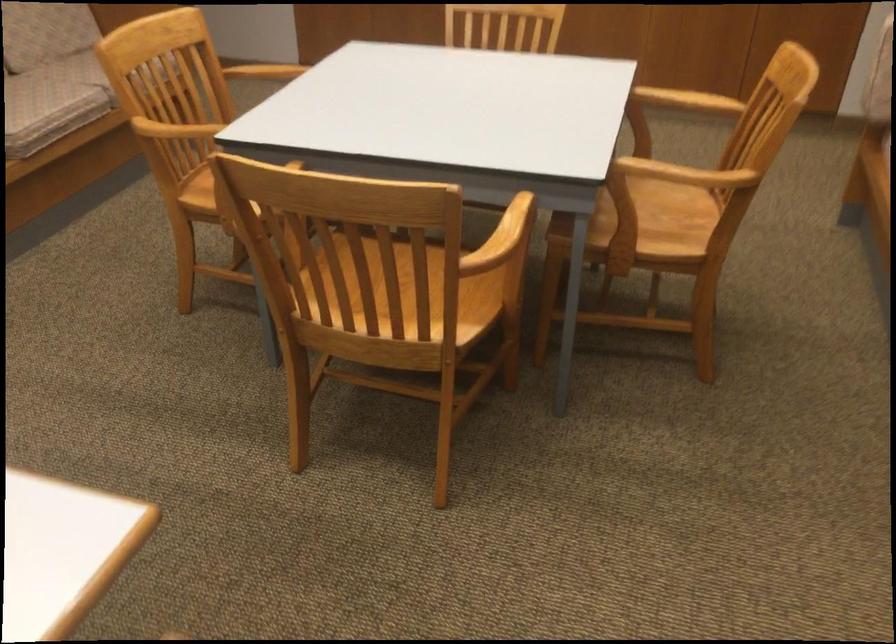
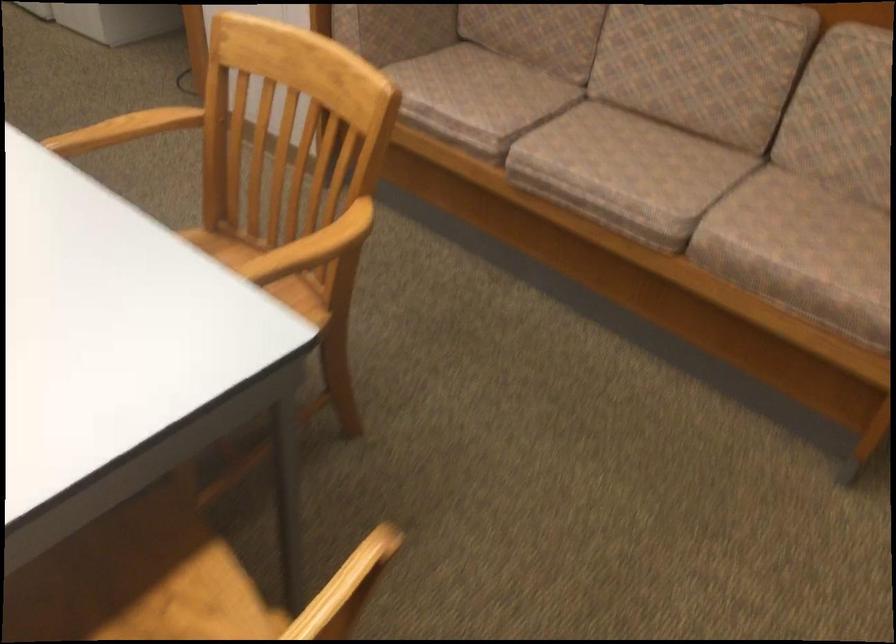
In the second image, find the point that corresponds to (x=202, y=190) in the first image.

(218, 247)